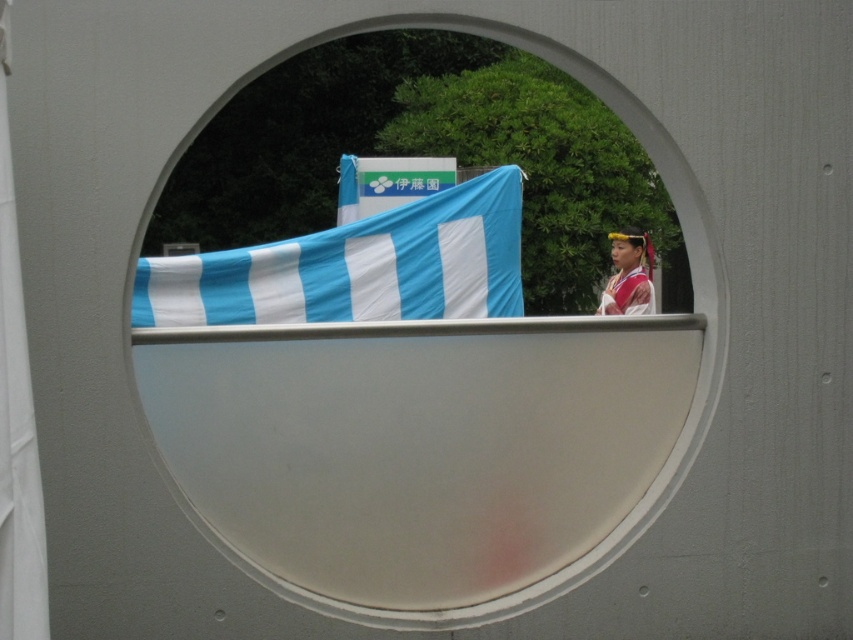
Question: Which point is farther to the camera?

Choices:
 (A) (32, 435)
 (B) (456, 20)
 (C) (631, 248)
 (D) (380, 260)

Answer: (C)

Question: Does blue/white striped fabric at center appear on the left side of silk-like pink dress at center?

Choices:
 (A) no
 (B) yes

Answer: (B)

Question: Among these points, which one is nearest to the camera?

Choices:
 (A) (502, 29)
 (B) (642, 308)
 (C) (386, 259)

Answer: (A)

Question: Is white matte oval at center closer to camera compared to white fabric curtain at left?

Choices:
 (A) no
 (B) yes

Answer: (A)

Question: Can you confirm if white matte oval at center is wider than white fabric curtain at left?

Choices:
 (A) yes
 (B) no

Answer: (A)

Question: Which object is the closest to the silk-like pink dress at center?

Choices:
 (A) white fabric curtain at left
 (B) blue/white striped fabric at center

Answer: (B)